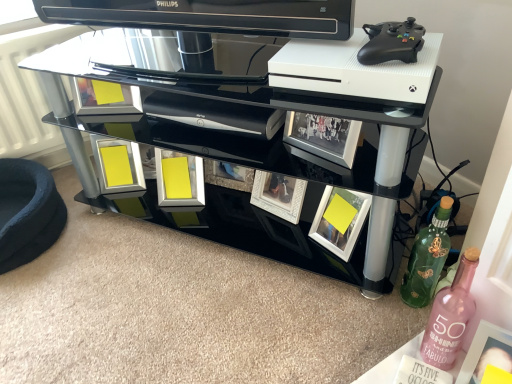
In order to click on vacant space in between yellow matte picture frame at lower right, which ranks as the second picture frame in front-to-back order, and pink glass bottle at lower right, which is counted as the second bottle, starting from the back in this screenshot , I will do `click(382, 304)`.